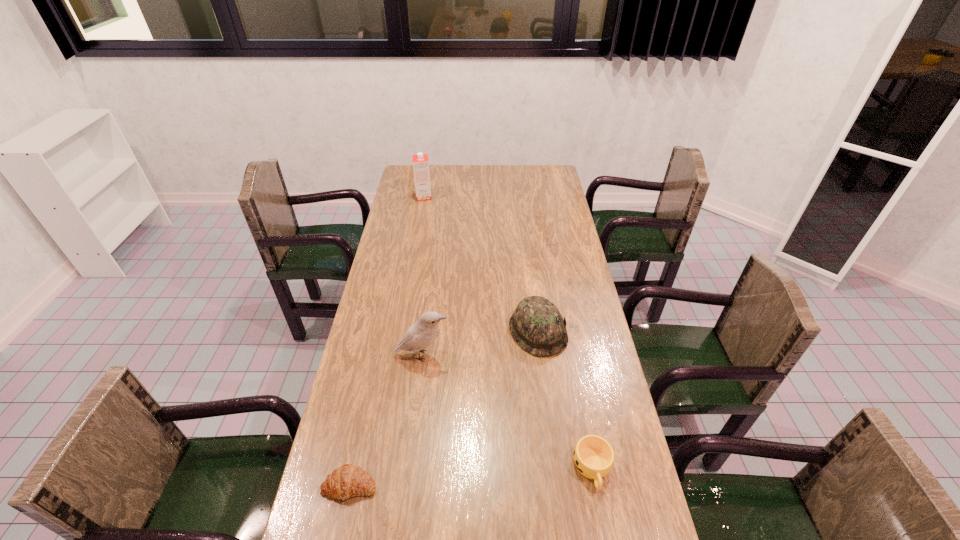
Where is `the farthest object`? the farthest object is located at coordinates (420, 161).

The image size is (960, 540). What are the coordinates of `bird` in the screenshot? It's located at (425, 330).

Find the location of a particular element. This screenshot has width=960, height=540. the third tallest object is located at coordinates (537, 325).

Where is `cup`? The height and width of the screenshot is (540, 960). cup is located at coordinates (593, 456).

This screenshot has height=540, width=960. Find the location of `crescent roll`. crescent roll is located at coordinates (347, 481).

Locate an element on the screen. The height and width of the screenshot is (540, 960). vacant space located on the left of the farthest object is located at coordinates (403, 197).

The image size is (960, 540). In order to click on vacant space located 0.380m at the beak of the bird in this screenshot , I will do `click(569, 355)`.

The height and width of the screenshot is (540, 960). In order to click on vacant space located 0.230m on the left of the headwear in this screenshot , I will do `click(441, 331)`.

Identify the location of vacant space located 0.310m on the left of the cup. (451, 469).

What are the coordinates of `free region located on the back of the crescent roll` in the screenshot? It's located at (378, 353).